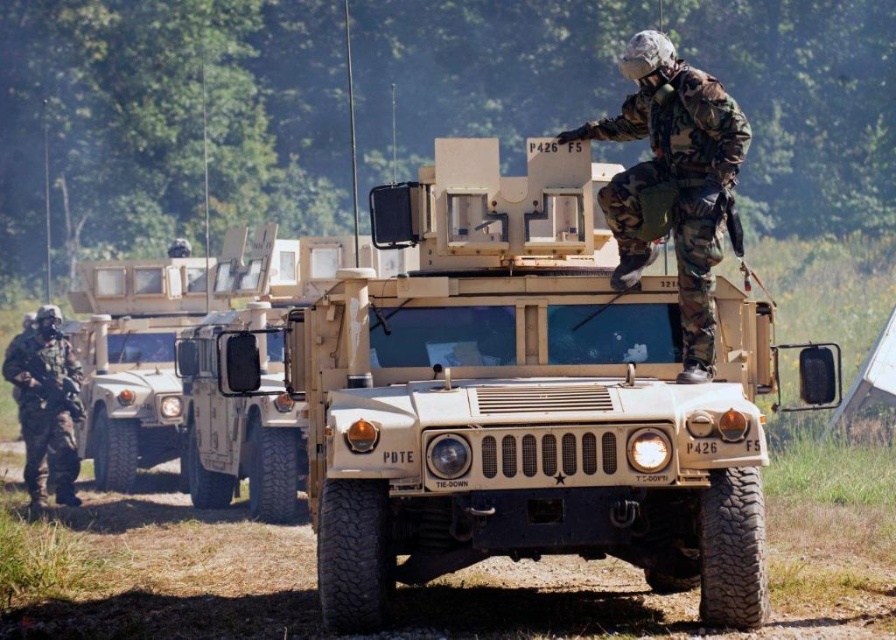
Question: Among these objects, which one is farthest from the camera?

Choices:
 (A) camouflage fabric soldier at center
 (B) camouflage fabric uniform at left

Answer: (B)

Question: In this image, where is camouflage fabric soldier at center located relative to camouflage fabric uniform at left?

Choices:
 (A) left
 (B) right

Answer: (B)

Question: Is camouflage fabric soldier at center above camouflage fabric uniform at left?

Choices:
 (A) yes
 (B) no

Answer: (A)

Question: Does camouflage fabric soldier at center have a greater width compared to camouflage fabric uniform at left?

Choices:
 (A) yes
 (B) no

Answer: (A)

Question: Among these points, which one is nearest to the camera?

Choices:
 (A) (679, 77)
 (B) (59, 385)

Answer: (A)

Question: Which point appears farthest from the camera in this image?

Choices:
 (A) (47, 458)
 (B) (653, 106)

Answer: (A)